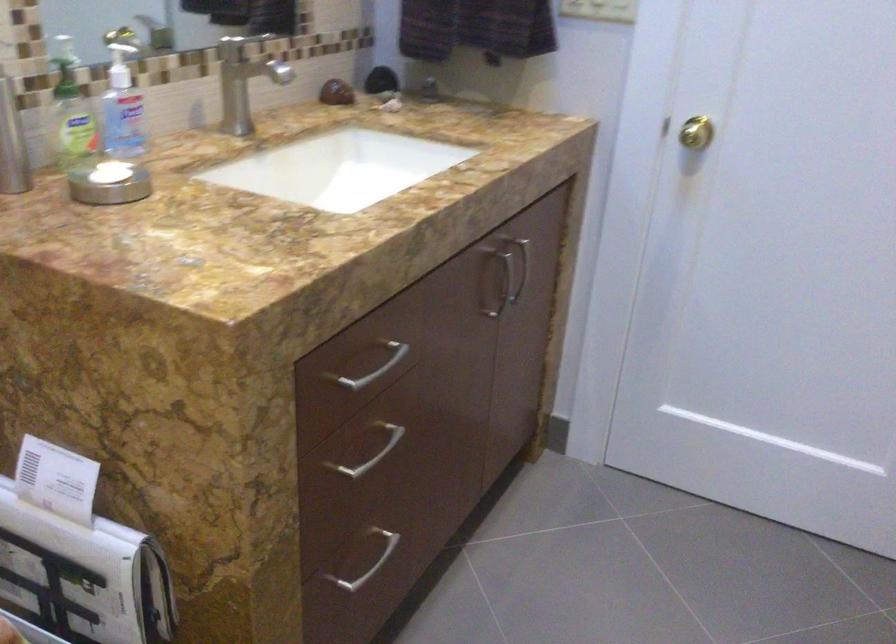
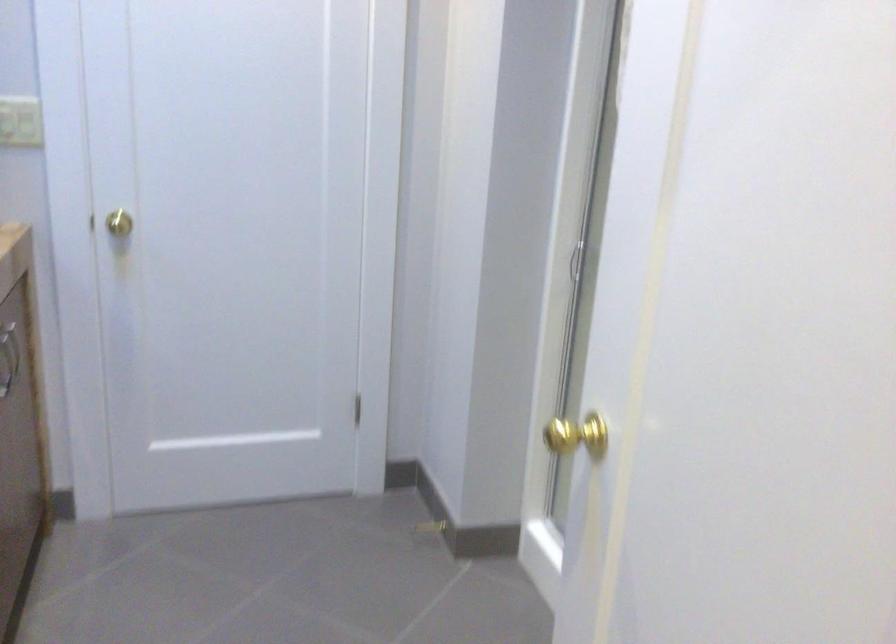
Question: The images are taken continuously from a first-person perspective. In which direction is your viewpoint rotating?

Choices:
 (A) Left
 (B) Right
 (C) Up
 (D) Down

Answer: (B)